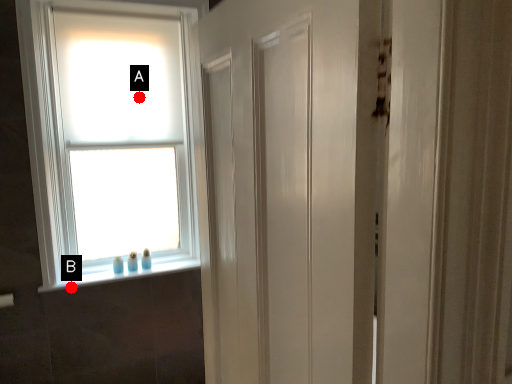
Question: Two points are circled on the image, labeled by A and B beside each circle. Which point is farther to the camera?

Choices:
 (A) A is further
 (B) B is further

Answer: (A)